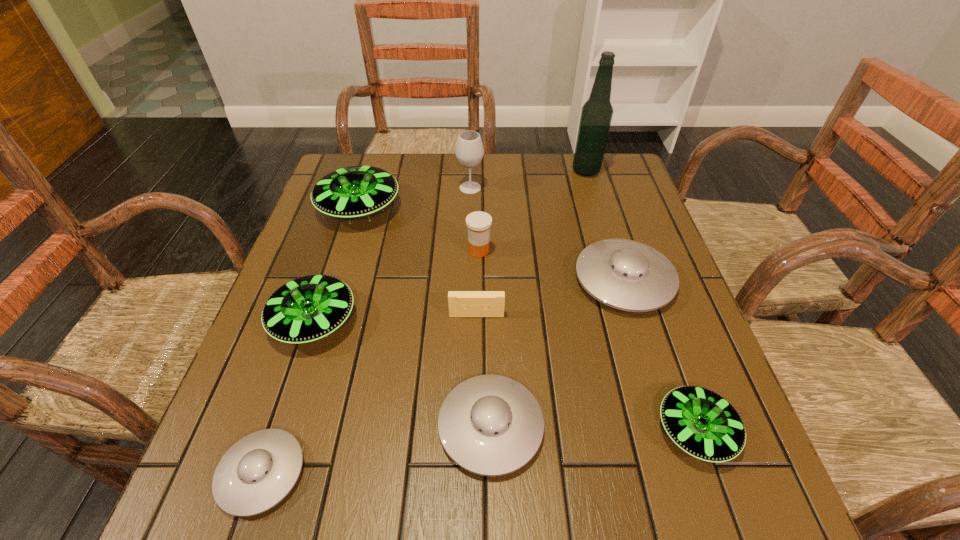
In order to click on the tallest object in this screenshot , I will do `click(596, 115)`.

The width and height of the screenshot is (960, 540). Find the location of `green alcohol`. green alcohol is located at coordinates pyautogui.click(x=596, y=115).

Locate an element on the screen. The width and height of the screenshot is (960, 540). wineglass is located at coordinates (469, 151).

Find the location of `the biggest green saucer`. the biggest green saucer is located at coordinates (351, 192).

Identify the location of the farthest green saucer. (351, 192).

Image resolution: width=960 pixels, height=540 pixels. Identify the location of medicine. (478, 223).

Find the location of `the second tallest saucer`. the second tallest saucer is located at coordinates (306, 309).

The image size is (960, 540). Identify the location of the second smallest green saucer. (x=306, y=309).

Where is `the farthest gray saucer`? The width and height of the screenshot is (960, 540). the farthest gray saucer is located at coordinates (624, 274).

I want to click on the biggest gray saucer, so click(x=624, y=274).